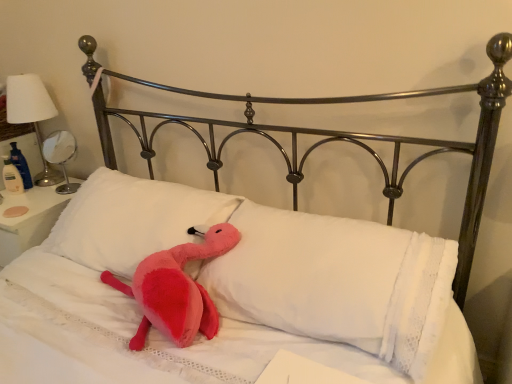
Question: Is white glossy table lamp at left, the second table lamp when ordered from left to right, completely or partially inside white soft pillow at center, which is the 2th pillow in right-to-left order?

Choices:
 (A) yes
 (B) no

Answer: (B)

Question: From the image's perspective, is white soft pillow at center, the first pillow viewed from the left, located beneath white glossy table lamp at left, the first table lamp positioned from the right?

Choices:
 (A) no
 (B) yes

Answer: (B)

Question: Are white soft pillow at center, the first pillow viewed from the left, and white glossy table lamp at left, the first table lamp positioned from the right, beside each other?

Choices:
 (A) no
 (B) yes

Answer: (A)

Question: Can we say white soft pillow at center, the first pillow viewed from the left, lies outside white glossy table lamp at left, the first table lamp positioned from the right?

Choices:
 (A) yes
 (B) no

Answer: (A)

Question: Does white soft pillow at center, which is the 2th pillow in right-to-left order, have a lesser width compared to white glossy table lamp at left, the second table lamp when ordered from left to right?

Choices:
 (A) no
 (B) yes

Answer: (A)

Question: From a real-world perspective, is white soft pillow at center, which is the 2th pillow in right-to-left order, under white glossy table lamp at left, the first table lamp positioned from the right?

Choices:
 (A) yes
 (B) no

Answer: (A)

Question: Are metallic silver table lamp at left, which is the first table lamp from left to right, and white soft pillow at center, which ranks as the first pillow in right-to-left order, located far from each other?

Choices:
 (A) yes
 (B) no

Answer: (A)

Question: Is metallic silver table lamp at left, the 2th table lamp in the right-to-left sequence, outside white soft pillow at center, which ranks as the first pillow in right-to-left order?

Choices:
 (A) no
 (B) yes

Answer: (B)

Question: From a real-world perspective, is metallic silver table lamp at left, the 2th table lamp in the right-to-left sequence, on white soft pillow at center, which is the second pillow in left-to-right order?

Choices:
 (A) yes
 (B) no

Answer: (A)

Question: Considering the relative positions of metallic silver table lamp at left, the 2th table lamp in the right-to-left sequence, and white soft pillow at center, which is the second pillow in left-to-right order, in the image provided, is metallic silver table lamp at left, the 2th table lamp in the right-to-left sequence, to the left of white soft pillow at center, which is the second pillow in left-to-right order, from the viewer's perspective?

Choices:
 (A) yes
 (B) no

Answer: (A)

Question: From the image's perspective, is metallic silver table lamp at left, which is the first table lamp from left to right, above white soft pillow at center, which is the second pillow in left-to-right order?

Choices:
 (A) no
 (B) yes

Answer: (B)

Question: From the image's perspective, is metallic silver table lamp at left, the 2th table lamp in the right-to-left sequence, below white soft pillow at center, which ranks as the first pillow in right-to-left order?

Choices:
 (A) no
 (B) yes

Answer: (A)

Question: Is white soft pillow at center, which is the second pillow in left-to-right order, far from white glossy table lamp at left, the first table lamp positioned from the right?

Choices:
 (A) yes
 (B) no

Answer: (A)